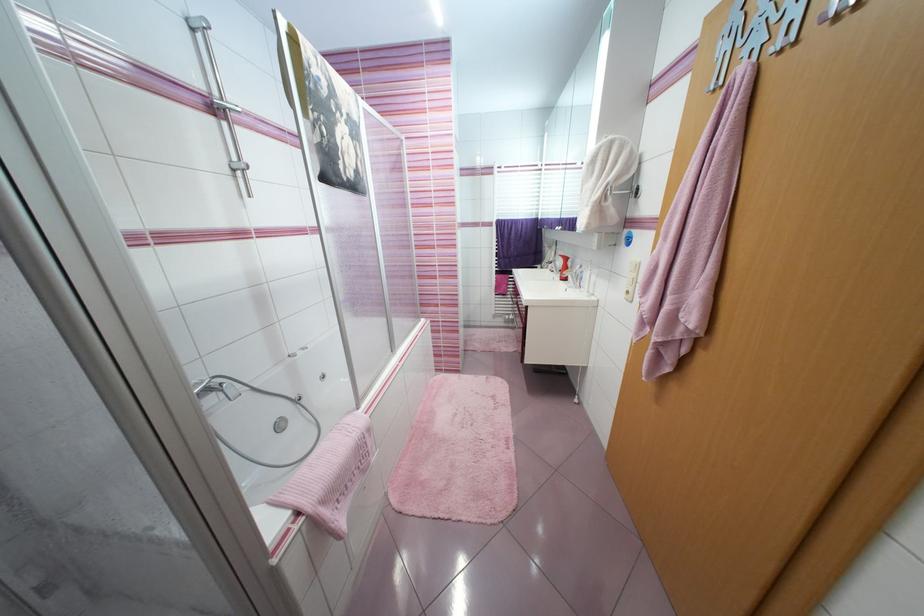
The width and height of the screenshot is (924, 616). What do you see at coordinates (569, 136) in the screenshot?
I see `the mirror cabinet door` at bounding box center [569, 136].